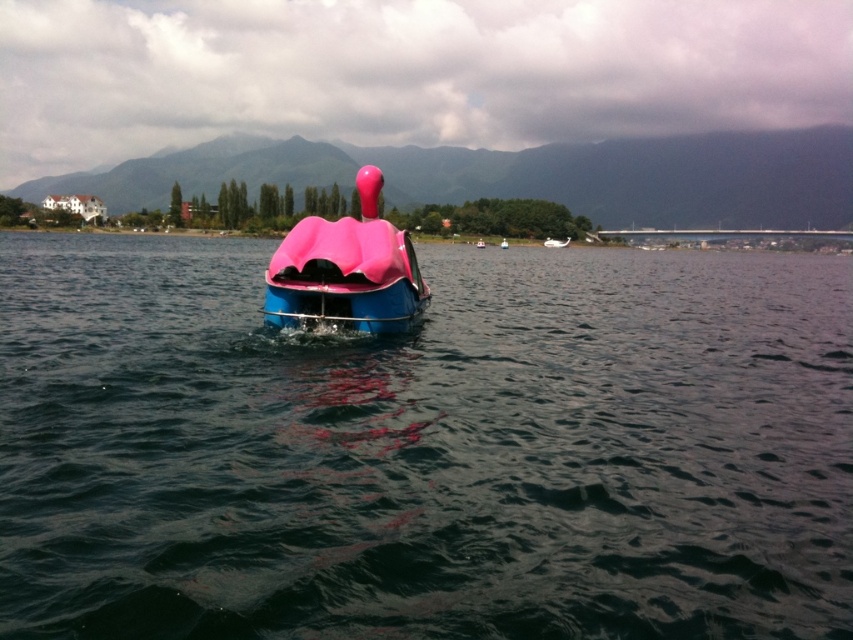
You are standing on the shore of the lake and see two points marked on the water. The first point is at coordinate point(271, 515) and the second is at point(566, 240). Which point is closer to you?

Point(271, 515) is in front of point(566, 240), so it is closer to you.

Looking at this image, you are a photographer trying to capture the pink matte swan boat at center and the pink matte swan at center in the same frame. Which object is located to the left of the other?

The pink matte swan boat at center is positioned on the left side of pink matte swan at center.